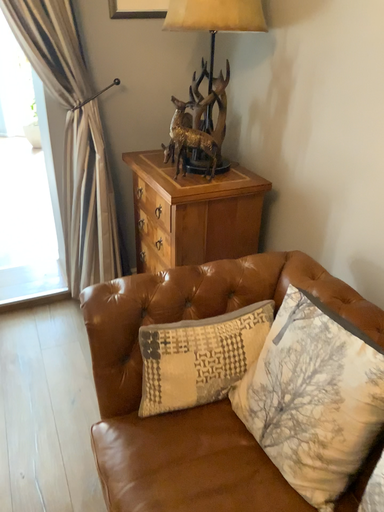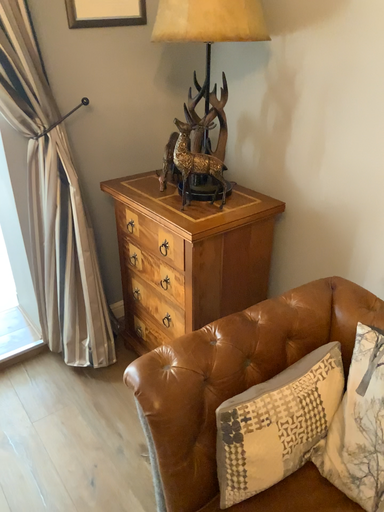
Question: Which way did the camera rotate in the video?

Choices:
 (A) rotated right
 (B) rotated left

Answer: (A)